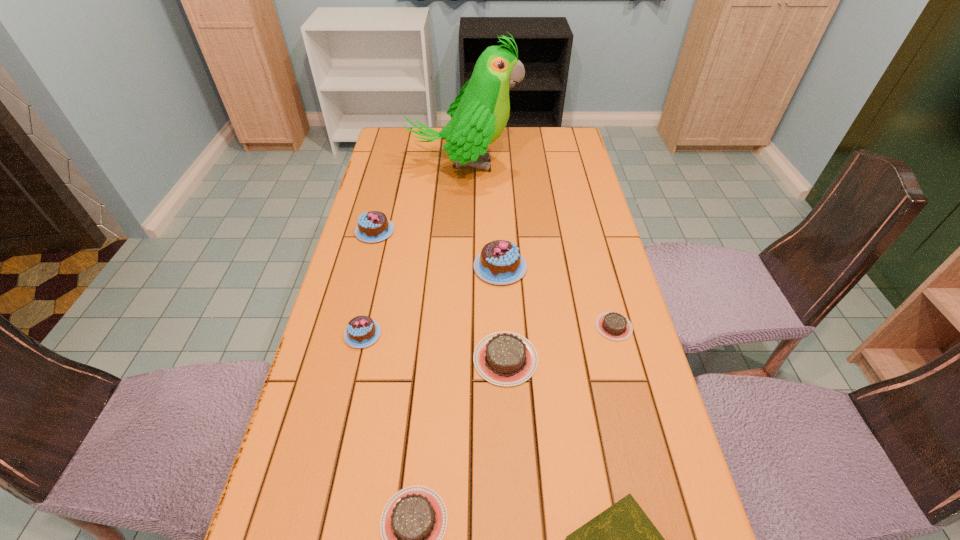
Locate an element on the screen. Image resolution: width=960 pixels, height=540 pixels. the rightmost chocolate cake is located at coordinates (612, 325).

Locate an element on the screen. the rightmost brown chocolate cake is located at coordinates (612, 325).

The width and height of the screenshot is (960, 540). In order to click on vacant space situated 0.170m on the beak of the farthest object in this screenshot , I will do `click(565, 165)`.

Image resolution: width=960 pixels, height=540 pixels. Find the location of `vacant region located 0.100m on the left of the second nearest pink chocolate cake`. vacant region located 0.100m on the left of the second nearest pink chocolate cake is located at coordinates (438, 267).

You are a GUI agent. You are given a task and a screenshot of the screen. Output one action in this format:
    pyautogui.click(x=<x>, y=<y>)
    Task: Click on the free spot located 0.240m on the back of the farthest pink chocolate cake
    
    Given the screenshot: What is the action you would take?
    pyautogui.click(x=389, y=176)

You are a GUI agent. You are given a task and a screenshot of the screen. Output one action in this format:
    pyautogui.click(x=<x>, y=<y>)
    Task: Click on the free region located 0.120m on the back of the nearest pink chocolate cake
    Image resolution: width=960 pixels, height=540 pixels.
    Given the screenshot: What is the action you would take?
    pyautogui.click(x=374, y=285)

This screenshot has width=960, height=540. Identify the location of free region located on the right of the fourth shortest object. (585, 359).

Find the location of `free space located 0.300m on the left of the rightmost chocolate cake`. free space located 0.300m on the left of the rightmost chocolate cake is located at coordinates (474, 327).

Identify the location of object located at the far edge. Image resolution: width=960 pixels, height=540 pixels. (479, 114).

You are a GUI agent. You are given a task and a screenshot of the screen. Output one action in this format:
    pyautogui.click(x=<x>, y=<y>)
    Task: Click on the parakeet that is at the left edge
    
    Given the screenshot: What is the action you would take?
    pyautogui.click(x=479, y=114)